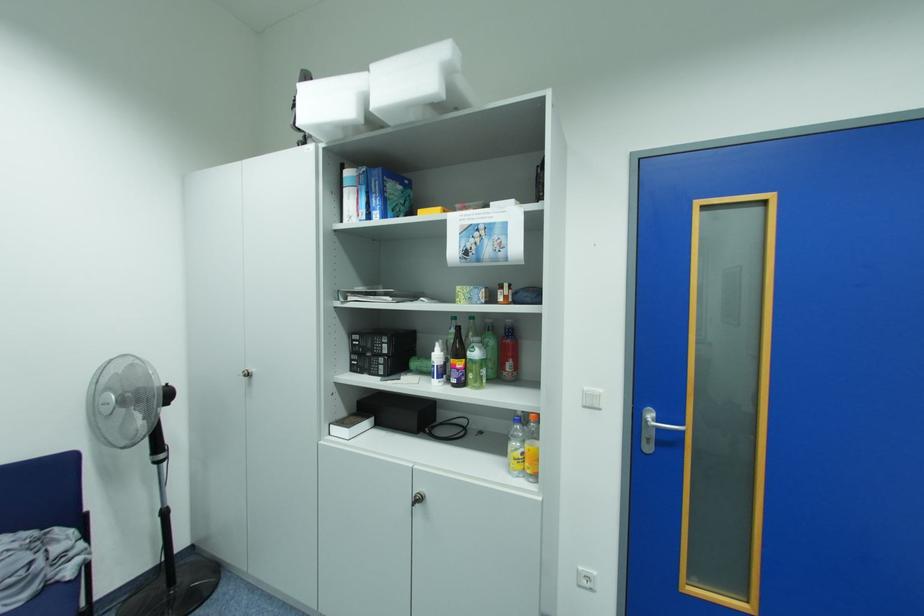
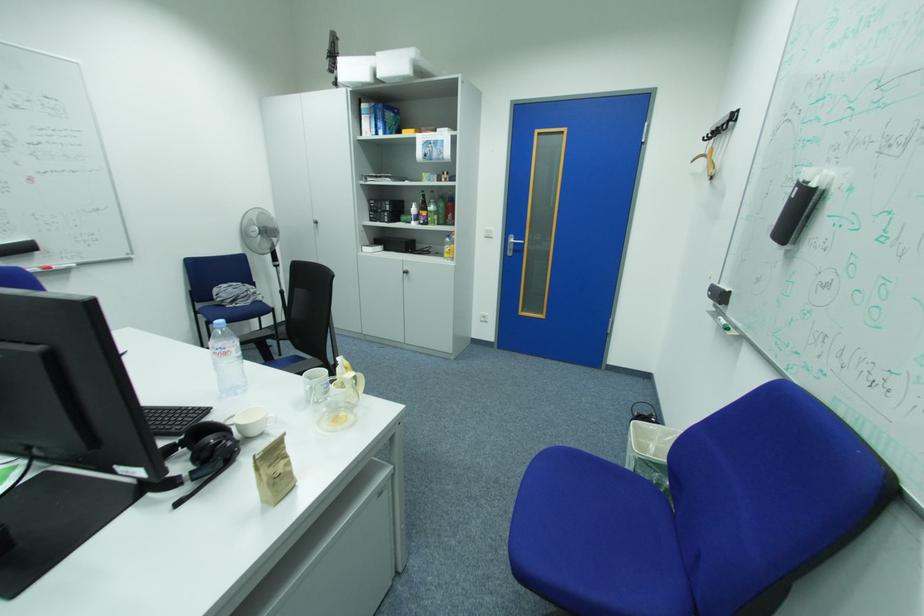
Where in the second image is the point corresponding to (445,357) from the first image?

(422, 211)